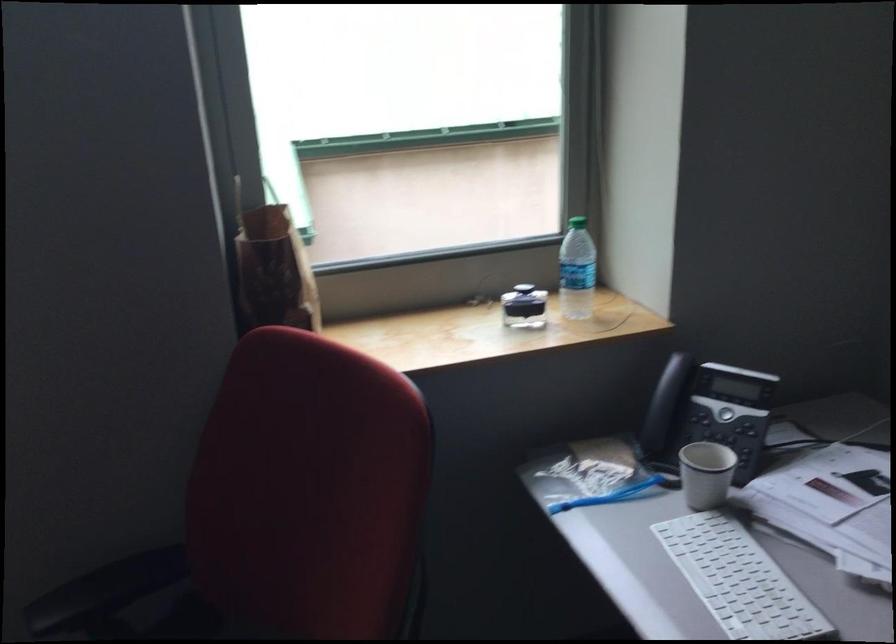
Where would you lift the black bottle lid? Please return your answer as a coordinate pair (x, y).

(523, 307)